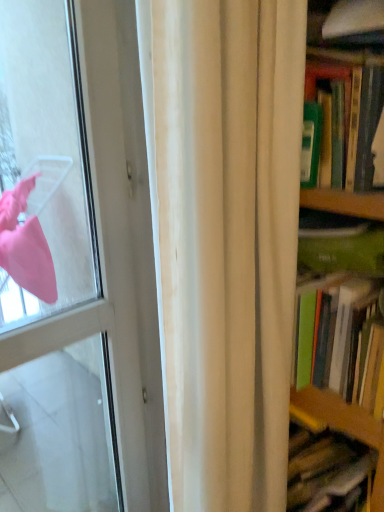
This screenshot has height=512, width=384. Find the location of `white fabric curtain at center`. white fabric curtain at center is located at coordinates (226, 239).

Describe the element at coordinates (226, 239) in the screenshot. I see `white fabric curtain at center` at that location.

Where is `green matte book at right`? The width and height of the screenshot is (384, 512). green matte book at right is located at coordinates (352, 103).

In order to face white glossy door at left, should I rotate leftwards or rightwards?

Rotate your view left by about 17.177°.

This screenshot has height=512, width=384. Find the location of `white fabric curtain at center`. white fabric curtain at center is located at coordinates (x=226, y=239).

Can you confirm if green matte book at right is shorter than white fabric curtain at center?

Correct, green matte book at right is not as tall as white fabric curtain at center.

The image size is (384, 512). Find the location of `curtain in front of the green matte book at right`. curtain in front of the green matte book at right is located at coordinates (226, 239).

Is green matte book at right not close to white fabric curtain at center?

green matte book at right is actually quite close to white fabric curtain at center.

From a real-world perspective, is green matte book at right physically located above or below white fabric curtain at center?

In terms of real-world spatial position, green matte book at right is above white fabric curtain at center.

Is white fabric curtain at center touching white glossy door at left?

white fabric curtain at center and white glossy door at left are not in contact.

From a real-world perspective, is white fabric curtain at center on white glossy door at left?

Yes, from a real-world perspective, white fabric curtain at center is over white glossy door at left

From the image's perspective, is white fabric curtain at center over white glossy door at left?

No, from the image's perspective, white fabric curtain at center is not on top of white glossy door at left.

Is white fabric curtain at center taller or shorter than white glossy door at left?

white fabric curtain at center is shorter than white glossy door at left.

Is green matte book at right at the left side of white glossy door at left?

Incorrect, green matte book at right is not on the left side of white glossy door at left.

Is point (308, 51) closer or farther from the camera than point (161, 400)?

Point (308, 51) appears to be closer to the viewer than point (161, 400).

Is green matte book at right inside or outside of white glossy door at left?

green matte book at right is not inside white glossy door at left, it's outside.

From a real-world perspective, is green matte book at right positioned over white glossy door at left based on gravity?

Correct, in the physical world, green matte book at right is higher than white glossy door at left.

Based on the photo, would you consider white fabric curtain at center to be distant from green matte book at right?

No, there isn't a large distance between white fabric curtain at center and green matte book at right.

How many degrees apart are the facing directions of white fabric curtain at center and green matte book at right?

They differ by 89.9 degrees in their facing directions.

Between white fabric curtain at center and green matte book at right, which one has smaller size?

green matte book at right is smaller.

Can you confirm if white fabric curtain at center is wider than green matte book at right?

No.

This screenshot has width=384, height=512. I want to click on door in front of the green matte book at right, so click(81, 262).

Based on the photo, is white glossy door at left taller than green matte book at right?

Yes.

Based on the photo, from a real-world perspective, is white glossy door at left physically below green matte book at right?

Yes, from a real-world perspective, white glossy door at left is under green matte book at right.

How much distance is there between white glossy door at left and green matte book at right?

white glossy door at left is 38.40 inches from green matte book at right.

Can you confirm if white glossy door at left is wider than white fabric curtain at center?

No.

Considering the positions of point (121, 447) and point (241, 423), is point (121, 447) closer or farther from the camera than point (241, 423)?

Point (121, 447) is positioned farther from the camera compared to point (241, 423).

Considering the sizes of objects white glossy door at left and white fabric curtain at center in the image provided, who is shorter, white glossy door at left or white fabric curtain at center?

Standing shorter between the two is white fabric curtain at center.

This screenshot has width=384, height=512. I want to click on book on the right of the white fabric curtain at center, so click(352, 103).

In order to click on door below the white fabric curtain at center (from a real-world perspective) in this screenshot , I will do `click(81, 262)`.

Estimate the real-world distances between objects in this image. Which object is closer to green matte book at right, white glossy door at left or white fabric curtain at center?

white fabric curtain at center.

Considering their positions, is green matte book at right positioned closer to white fabric curtain at center than white glossy door at left?

Based on the image, green matte book at right appears to be nearer to white fabric curtain at center.

When comparing their distances from green matte book at right, does white fabric curtain at center or white glossy door at left seem further?

The object further to green matte book at right is white glossy door at left.

Based on their spatial positions, is white glossy door at left or green matte book at right further from white fabric curtain at center?

white glossy door at left is positioned further to the anchor white fabric curtain at center.

Estimate the real-world distances between objects in this image. Which object is closer to white glossy door at left, white fabric curtain at center or green matte book at right?

white fabric curtain at center lies closer to white glossy door at left than the other object.

Based on their spatial positions, is green matte book at right or white fabric curtain at center further from white glossy door at left?

green matte book at right is positioned further to the anchor white glossy door at left.

Locate an element on the screen. curtain situated between white glossy door at left and green matte book at right from left to right is located at coordinates [x=226, y=239].